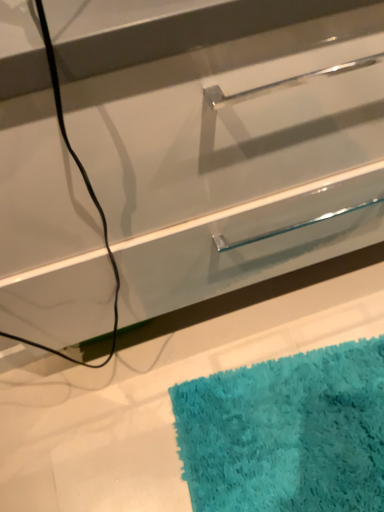
I want to click on free space to the back side of turquoise shaggy bath mat at lower right, so click(x=279, y=324).